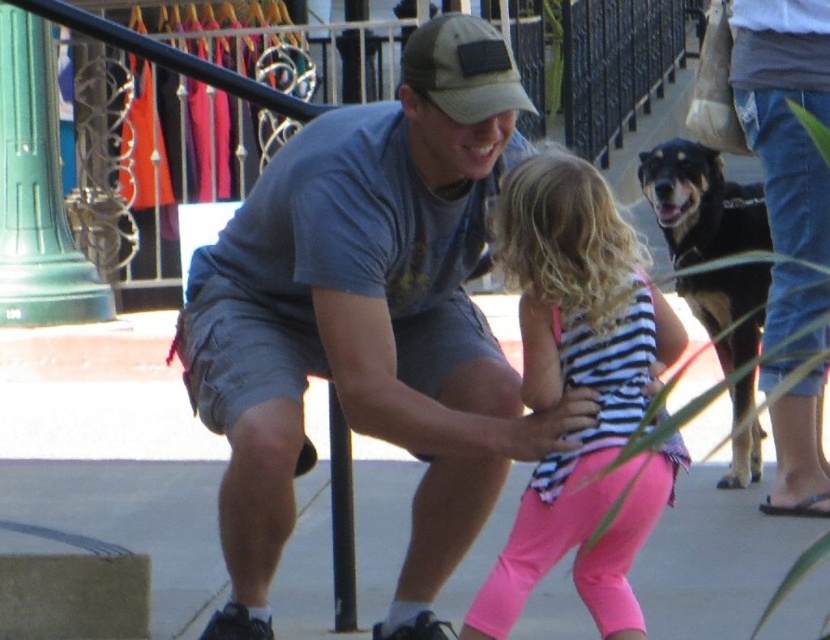
You are a photographer trying to capture a candid shot of the camouflage fabric baseball cap at center and the black fur dog at right. From your current position, can you see both objects clearly without any obstruction?

The camouflage fabric baseball cap at center is behind the black fur dog at right, so the photographer cannot see the camouflage fabric baseball cap at center clearly because it is obstructed by the black fur dog at right.

You are standing at the point labeled point (567, 512) and want to move to the point labeled point (796, 54). Given that you can only move forward in a straight line, will you be able to reach the second point without changing direction?

Since point (567, 512) is closer to the viewer than point (796, 54), moving forward in a straight line from point (567, 512) will not reach point (796, 54) because it is further away. You would need to adjust your direction or path to reach the second point.